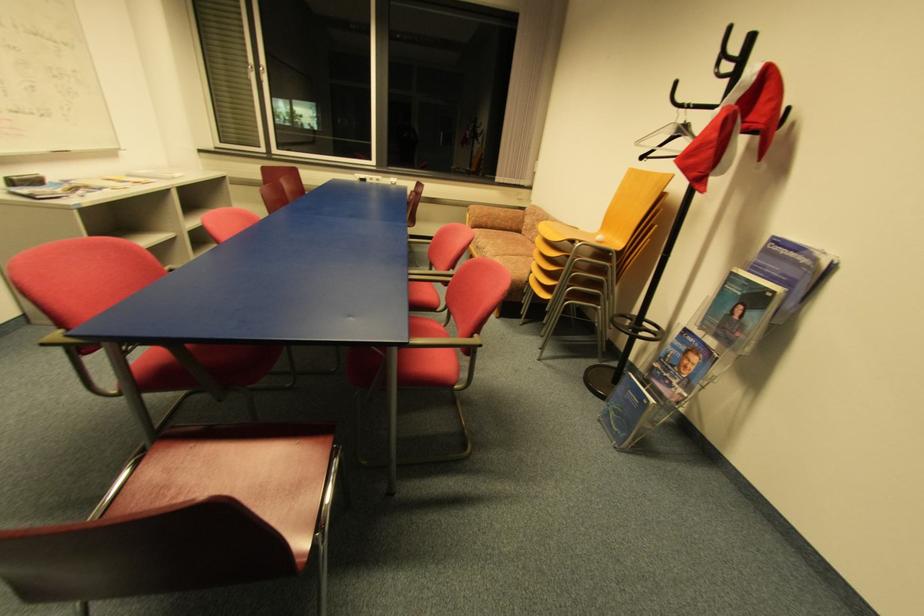
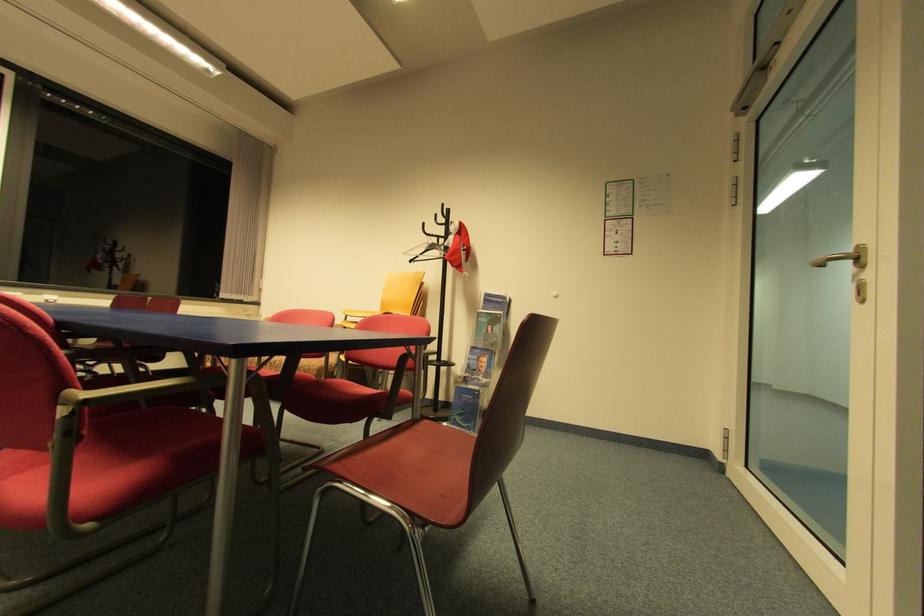
The point at (642, 144) is marked in the first image. Where is the corresponding point in the second image?

(408, 254)